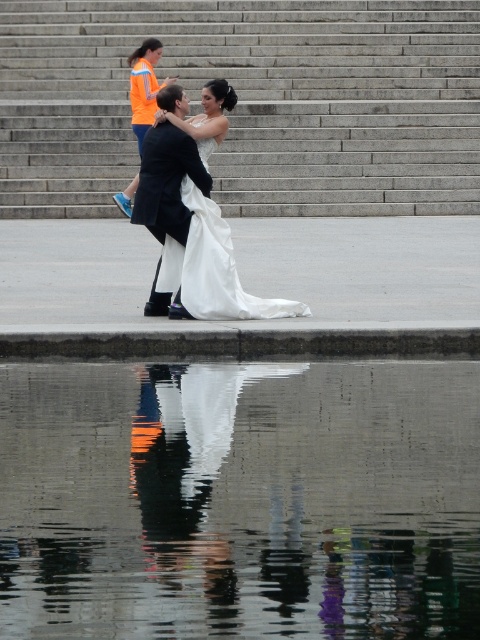
Question: Does glossy reflective water at center appear over white satin dress at center?

Choices:
 (A) no
 (B) yes

Answer: (A)

Question: Among these points, which one is farthest from the camera?

Choices:
 (A) (267, 632)
 (B) (200, 230)
 (C) (133, 65)
 (D) (158, 131)

Answer: (C)

Question: Where is white satin dress at center located in relation to orange fabric safety vest at upper left in the image?

Choices:
 (A) above
 (B) below

Answer: (B)

Question: Based on their relative distances, which object is farther from the shiny black suit at center?

Choices:
 (A) orange fabric safety vest at upper left
 (B) white glossy dress at center

Answer: (A)

Question: Which object is the closest to the orange fabric safety vest at upper left?

Choices:
 (A) glossy reflective water at center
 (B) shiny black suit at center
 (C) white glossy dress at center
 (D) gray concrete stairs at center

Answer: (D)

Question: Is glossy reflective water at center positioned in front of white satin dress at center?

Choices:
 (A) no
 (B) yes

Answer: (B)